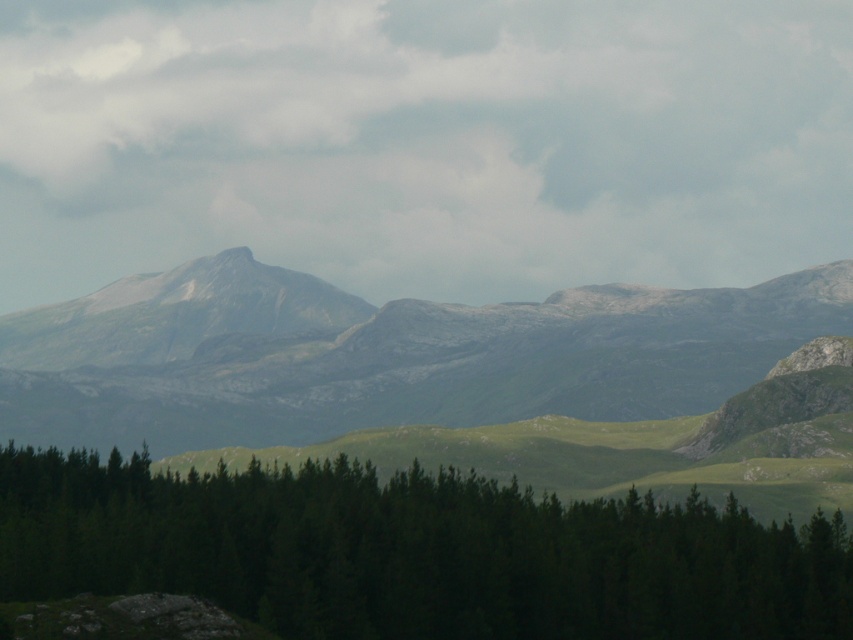
Can you confirm if green matte tree at center is shorter than gray rocky mountain range at center?

Correct, green matte tree at center is not as tall as gray rocky mountain range at center.

Is the position of green matte tree at center less distant than that of gray rocky mountain range at center?

Yes, it is in front of gray rocky mountain range at center.

Does point (172, 532) come in front of point (144, 288)?

Yes, point (172, 532) is in front of point (144, 288).

Locate an element on the screen. The image size is (853, 640). green matte tree at center is located at coordinates (415, 552).

Is gray/cloudy sky at upper center in front of green matte tree at center?

No, gray/cloudy sky at upper center is further to the viewer.

Is gray/cloudy sky at upper center thinner than green matte tree at center?

No.

Where is `gray/cloudy sky at upper center`? gray/cloudy sky at upper center is located at coordinates (424, 141).

Is point (372, 152) closer to viewer compared to point (131, 410)?

No, it is behind (131, 410).

Is gray/cloudy sky at upper center to the left of gray rocky mountain range at center from the viewer's perspective?

Incorrect, gray/cloudy sky at upper center is not on the left side of gray rocky mountain range at center.

Between point (704, 140) and point (44, 312), which one is positioned behind?

Positioned behind is point (704, 140).

The height and width of the screenshot is (640, 853). Find the location of `gray/cloudy sky at upper center`. gray/cloudy sky at upper center is located at coordinates (424, 141).